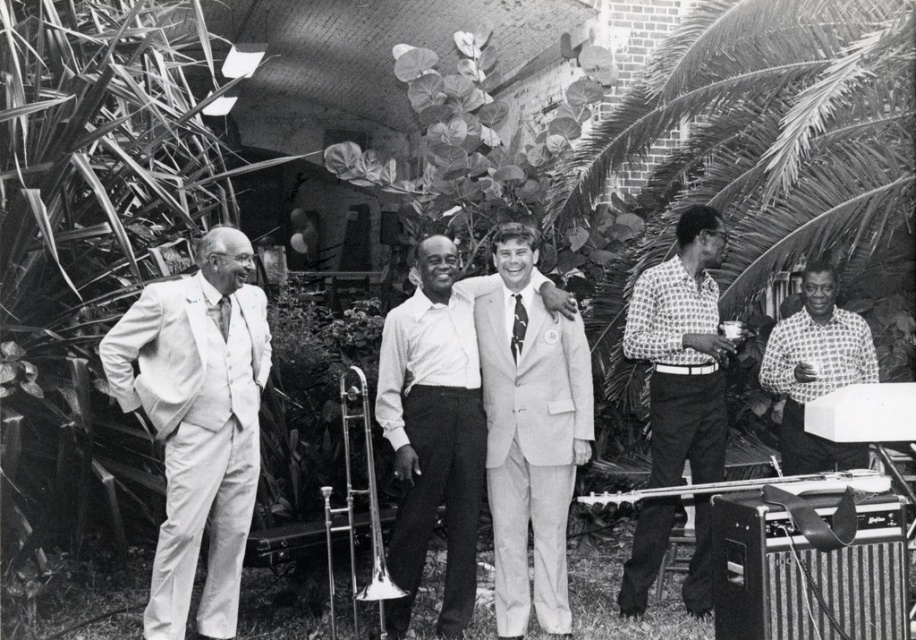
What is located at the coordinate point (x=434, y=433) in the image?

The light gray suit at center is located at point (x=434, y=433).

You are organizing a charity event and need to decide which suit to wear. You have two options in the image, the light gray suit at center and the light gray wool suit at center. Based on their thickness, which one would be more appropriate for a warm outdoor event?

The light gray suit at center is thinner than the light gray wool suit at center, making it more suitable for a warm outdoor event since thinner fabrics are cooler.

You are a tailor who needs to determine which garment requires a larger amount of fabric to alter. Based on the image, which one between the light gray wool suit at center and the printed cotton shirt at right needs more fabric?

The light gray wool suit at center requires more fabric since its width is larger than the printed cotton shirt at right.